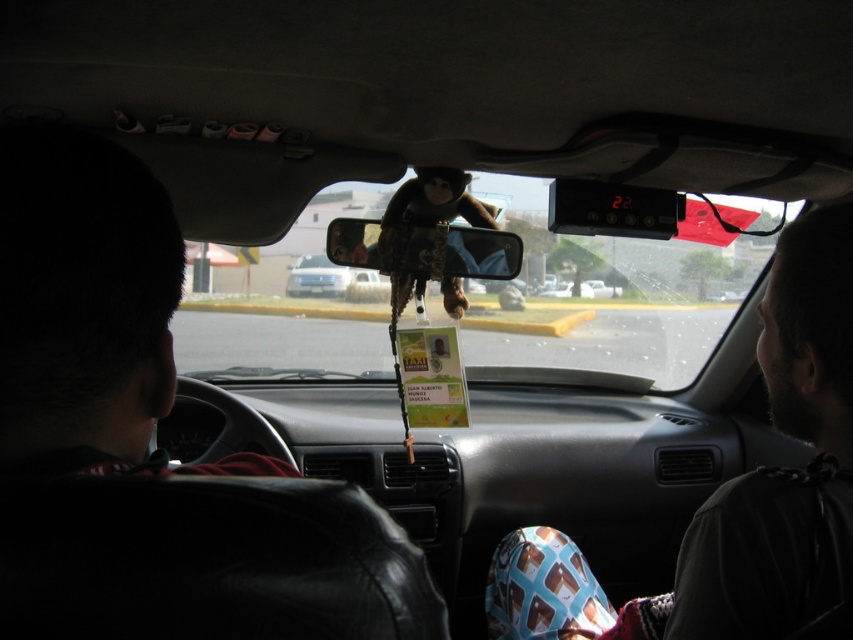
Question: Which of the following is the farthest from the observer?

Choices:
 (A) matte plastic view mirror at center
 (B) bearded man at right

Answer: (A)

Question: Is bearded man at right above fuzzy fabric monkey at center?

Choices:
 (A) no
 (B) yes

Answer: (A)

Question: Can you confirm if matte plastic view mirror at center is bigger than silver metallic car at center?

Choices:
 (A) no
 (B) yes

Answer: (A)

Question: Among these objects, which one is farthest from the camera?

Choices:
 (A) bearded man at right
 (B) fuzzy fabric monkey at center
 (C) silver metallic car at center
 (D) matte plastic view mirror at center

Answer: (C)

Question: Can you confirm if bearded man at right is positioned to the right of silver metallic car at center?

Choices:
 (A) yes
 (B) no

Answer: (A)

Question: Which is farther from the silver metallic car at center?

Choices:
 (A) bearded man at right
 (B) fuzzy fabric monkey at center
 (C) matte plastic view mirror at center

Answer: (A)